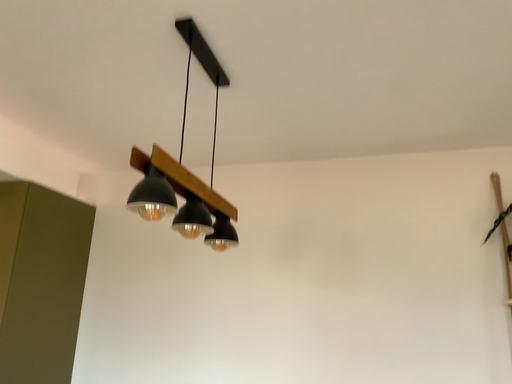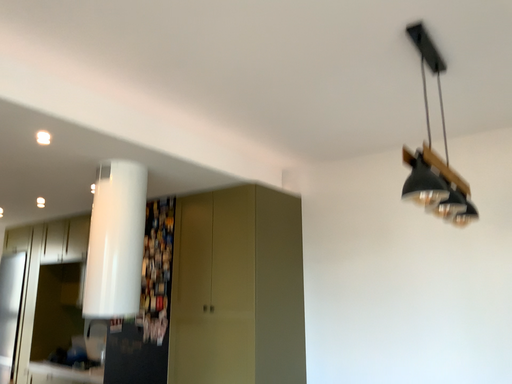
Question: How did the camera likely rotate when shooting the video?

Choices:
 (A) rotated left
 (B) rotated right

Answer: (A)